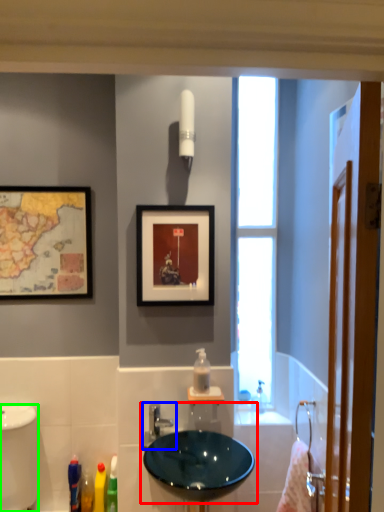
Question: Considering the real-world distances, which object is closest to sink (highlighted by a red box)? tap (highlighted by a blue box) or bidet (highlighted by a green box).

Choices:
 (A) tap
 (B) bidet

Answer: (A)